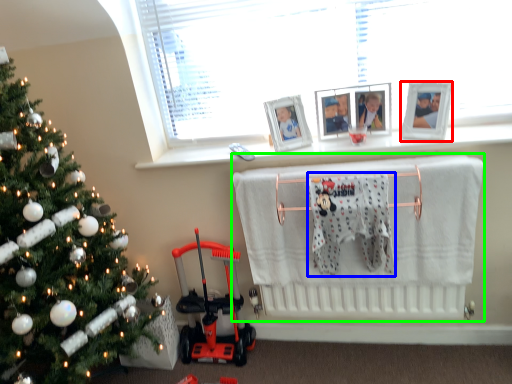
Question: Which object is positioned farthest from picture frame (highlighted by a red box)? Select from bath towel (highlighted by a blue box) and infant bed (highlighted by a green box).

Choices:
 (A) bath towel
 (B) infant bed

Answer: (B)